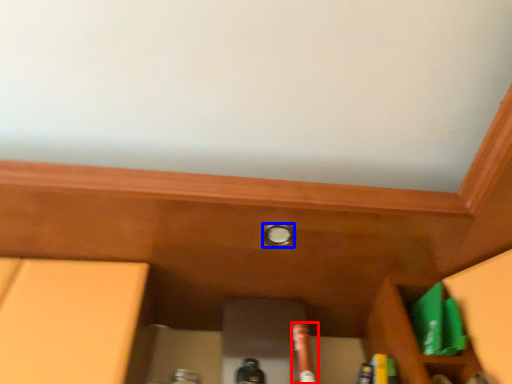
Question: Which object is further to the camera taking this photo, beer bottle (highlighted by a red box) or knob (highlighted by a blue box)?

Choices:
 (A) beer bottle
 (B) knob

Answer: (B)